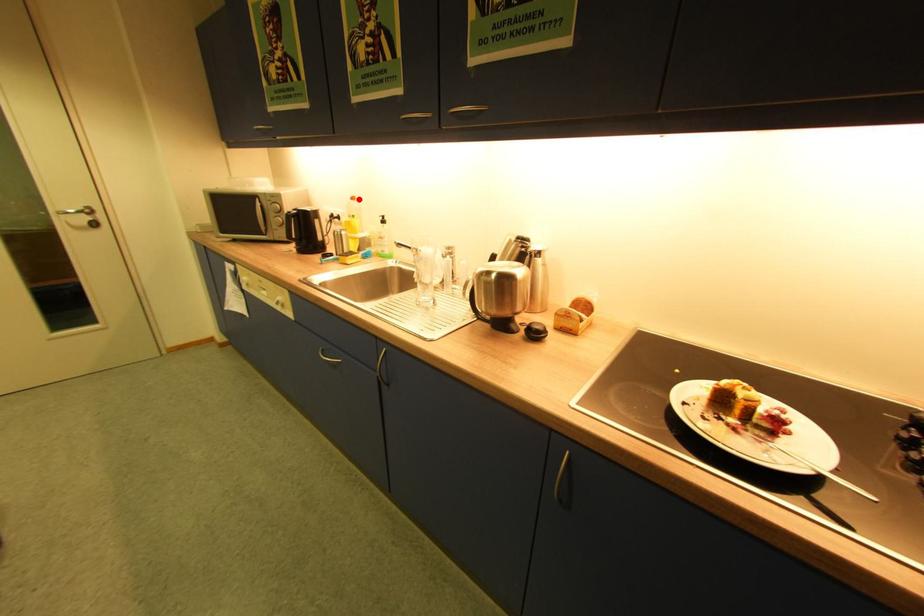
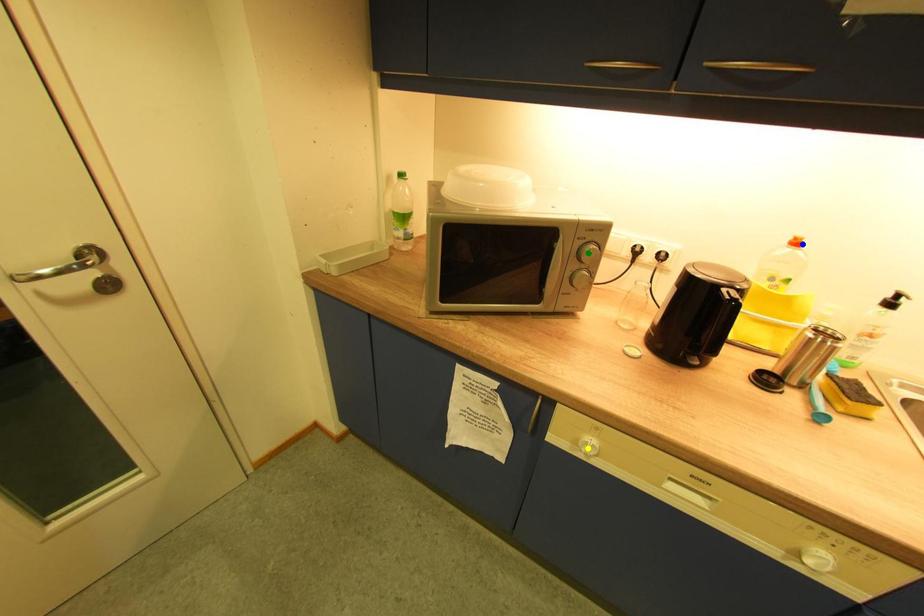
Question: I am providing you with two images of the same scene from different viewpoints. A red point is marked on the first image. You are given multiple points on the second image. Can you choose the point in image 2 that corresponds to the point in image 1?

Choices:
 (A) yellow point
 (B) blue point
 (C) green point

Answer: (B)